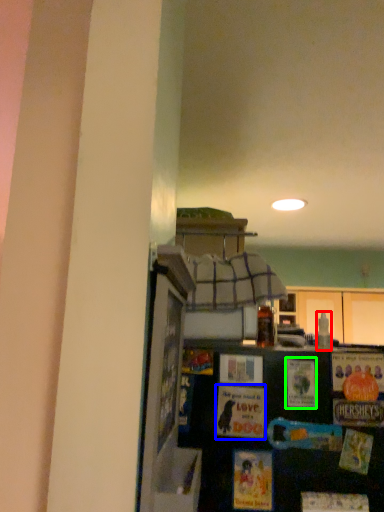
Question: Considering the real-world distances, which object is closest to bottle (highlighted by a red box)? postcard (highlighted by a blue box) or postcard (highlighted by a green box).

Choices:
 (A) postcard
 (B) postcard

Answer: (A)